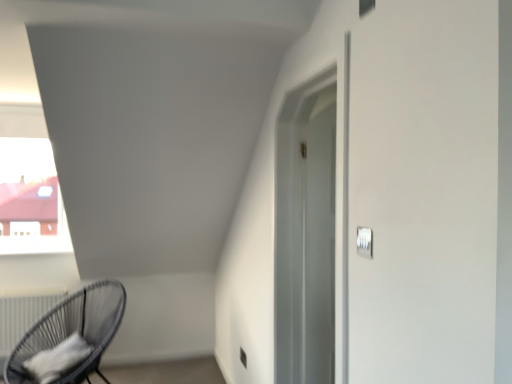
The width and height of the screenshot is (512, 384). Describe the element at coordinates (72, 331) in the screenshot. I see `black wicker chair at lower left` at that location.

This screenshot has height=384, width=512. I want to click on white matte radiator at lower left, so click(22, 317).

Can you confirm if satin silver outlet at lower center is wider than white plastic light switch at upper right?

Yes.

From a real-world perspective, is satin silver outlet at lower center physically located above or below white plastic light switch at upper right?

Clearly, from a real-world perspective, satin silver outlet at lower center is below white plastic light switch at upper right.

In order to click on electric outlet that appears on the left of white plastic light switch at upper right in this screenshot , I will do `click(243, 357)`.

Between point (9, 374) and point (3, 322), which one is positioned in front?

Positioned in front is point (9, 374).

Which object is closer to the camera taking this photo, black wicker chair at lower left or white matte radiator at lower left?

black wicker chair at lower left.

Which object is positioned more to the left, black wicker chair at lower left or white matte radiator at lower left?

white matte radiator at lower left is more to the left.

From the picture: From their relative heights in the image, would you say white plastic light switch at upper right is taller or shorter than white matte radiator at lower left?

Considering their sizes, white plastic light switch at upper right has less height than white matte radiator at lower left.

From a real-world perspective, is white plastic light switch at upper right below white matte radiator at lower left?

No, from a real-world perspective, white plastic light switch at upper right is not under white matte radiator at lower left.

Is white matte radiator at lower left inside white plastic light switch at upper right?

No, white matte radiator at lower left is not surrounded by white plastic light switch at upper right.

From the image's perspective, is white matte radiator at lower left below white plastic light switch at upper right?

Correct, white matte radiator at lower left appears lower than white plastic light switch at upper right in the image.

In the image, there is a white plastic light switch at upper right. At what (x,y) coordinates should I click in order to perform the action: click on radiator below it (from a real-world perspective). Please return your answer as a coordinate pair (x, y). This screenshot has height=384, width=512. Looking at the image, I should click on (22, 317).

Are white matte radiator at lower left and white plastic light switch at upper right located far from each other?

Yes, white matte radiator at lower left is far from white plastic light switch at upper right.

Is white matte radiator at lower left behind white plastic light switch at upper right?

Yes.

Are satin silver outlet at lower center and black wicker chair at lower left beside each other?

No, satin silver outlet at lower center is not beside black wicker chair at lower left.

Considering the sizes of satin silver outlet at lower center and black wicker chair at lower left in the image, is satin silver outlet at lower center bigger or smaller than black wicker chair at lower left?

Clearly, satin silver outlet at lower center is smaller in size than black wicker chair at lower left.

From the image's perspective, relative to black wicker chair at lower left, is satin silver outlet at lower center above or below?

Clearly, from the image's perspective, satin silver outlet at lower center is below black wicker chair at lower left.

From a real-world perspective, is satin silver outlet at lower center physically located above or below black wicker chair at lower left?

satin silver outlet at lower center is situated lower than black wicker chair at lower left in the real world.

Between white matte radiator at lower left and black wicker chair at lower left, which one has smaller width?

white matte radiator at lower left.

Image resolution: width=512 pixels, height=384 pixels. In order to click on radiator below the black wicker chair at lower left (from the image's perspective) in this screenshot , I will do `click(22, 317)`.

Considering the relative sizes of white matte radiator at lower left and black wicker chair at lower left in the image provided, is white matte radiator at lower left shorter than black wicker chair at lower left?

Yes.

From the image's perspective, is white plastic light switch at upper right positioned above or below satin silver outlet at lower center?

Based on their image positions, white plastic light switch at upper right is located above satin silver outlet at lower center.

Considering the points (358, 238) and (240, 360), which point is behind, point (358, 238) or point (240, 360)?

Point (240, 360)

Does white plastic light switch at upper right lie behind satin silver outlet at lower center?

No, white plastic light switch at upper right is closer to the camera.

At what (x,y) coordinates should I click in order to perform the action: click on electric outlet below the white plastic light switch at upper right (from a real-world perspective). Please return your answer as a coordinate pair (x, y). This screenshot has width=512, height=384. Looking at the image, I should click on (243, 357).

Find the location of a particular element. electric outlet on the left of white plastic light switch at upper right is located at coordinates (243, 357).

At what (x,y) coordinates should I click in order to perform the action: click on radiator below the black wicker chair at lower left (from a real-world perspective). Please return your answer as a coordinate pair (x, y). Looking at the image, I should click on (22, 317).

Based on their spatial positions, is white matte radiator at lower left or black wicker chair at lower left closer to white plastic light switch at upper right?

Based on the image, black wicker chair at lower left appears to be nearer to white plastic light switch at upper right.

Considering their positions, is white matte radiator at lower left positioned further to satin silver outlet at lower center than black wicker chair at lower left?

white matte radiator at lower left is positioned further to the anchor satin silver outlet at lower center.

Considering their positions, is black wicker chair at lower left positioned closer to satin silver outlet at lower center than white plastic light switch at upper right?

black wicker chair at lower left is positioned closer to the anchor satin silver outlet at lower center.

Looking at the image, which one is located closer to satin silver outlet at lower center, white plastic light switch at upper right or black wicker chair at lower left?

black wicker chair at lower left.

In the scene shown: When comparing their distances from black wicker chair at lower left, does white plastic light switch at upper right or satin silver outlet at lower center seem further?

white plastic light switch at upper right is further to black wicker chair at lower left.

When comparing their distances from white plastic light switch at upper right, does satin silver outlet at lower center or black wicker chair at lower left seem further?

black wicker chair at lower left is further to white plastic light switch at upper right.

Looking at the image, which one is located further to white plastic light switch at upper right, white matte radiator at lower left or satin silver outlet at lower center?

white matte radiator at lower left is positioned further to the anchor white plastic light switch at upper right.

When comparing their distances from white plastic light switch at upper right, does black wicker chair at lower left or satin silver outlet at lower center seem closer?

satin silver outlet at lower center lies closer to white plastic light switch at upper right than the other object.

You are a GUI agent. You are given a task and a screenshot of the screen. Output one action in this format:
    pyautogui.click(x=<x>, y=<y>)
    Task: Click on the chair situated between white matte radiator at lower left and satin silver outlet at lower center from left to right
    
    Given the screenshot: What is the action you would take?
    pyautogui.click(x=72, y=331)

Locate an element on the screen. The width and height of the screenshot is (512, 384). electric outlet situated between white matte radiator at lower left and white plastic light switch at upper right from left to right is located at coordinates (243, 357).

Locate an element on the screen. The height and width of the screenshot is (384, 512). electric outlet between black wicker chair at lower left and white plastic light switch at upper right from left to right is located at coordinates (243, 357).

At what (x,y) coordinates should I click in order to perform the action: click on chair between white matte radiator at lower left and white plastic light switch at upper right from left to right. Please return your answer as a coordinate pair (x, y). This screenshot has height=384, width=512. Looking at the image, I should click on (72, 331).